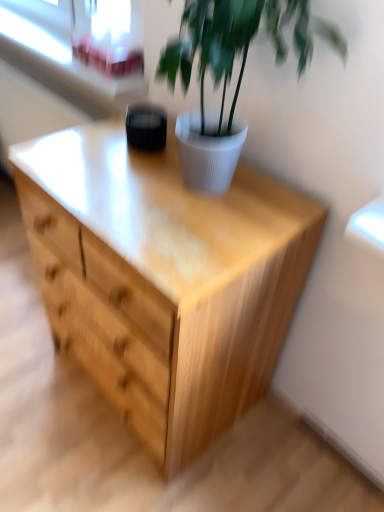
This screenshot has height=512, width=384. Identify the location of free region on the left part of white ribbed pot at upper center. (93, 170).